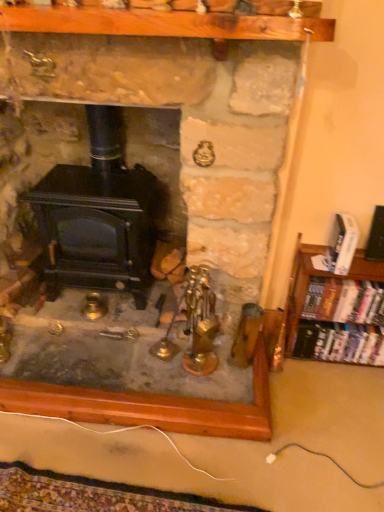
Find the location of a particular element. The image size is (384, 512). white glossy book at right, acting as the 1th book starting from the top is located at coordinates (342, 244).

Find the location of a particular element. The image size is (384, 512). black matte wood burning stove at center is located at coordinates pos(100,215).

I want to click on white glossy book at right, the third book from the bottom, so click(342, 244).

Is black matte wood burning stove at center inside hardcover books at right, which appears as the 2th book when ordered from the bottom?

No, hardcover books at right, which appears as the 2th book when ordered from the bottom, does not contain black matte wood burning stove at center.

Considering the relative positions of hardcover books at right, which appears as the 2th book when ordered from the bottom, and black matte wood burning stove at center in the image provided, is hardcover books at right, which appears as the 2th book when ordered from the bottom, in front of black matte wood burning stove at center?

No, hardcover books at right, which appears as the 2th book when ordered from the bottom, is further to the viewer.

Can you tell me how much hardcover books at right, the 2th book in the top-to-bottom sequence, and black matte wood burning stove at center differ in facing direction?

0.869 degrees.

Considering the sizes of objects hardcover books at right, the 1th book in the bottom-to-top sequence, and hardcover books at right, which appears as the 2th book when ordered from the bottom, in the image provided, who is wider, hardcover books at right, the 1th book in the bottom-to-top sequence, or hardcover books at right, which appears as the 2th book when ordered from the bottom,?

hardcover books at right, the 1th book in the bottom-to-top sequence.

From a real-world perspective, who is located higher, hardcover books at right, the 1th book in the bottom-to-top sequence, or hardcover books at right, which appears as the 2th book when ordered from the bottom?

In real-world perspective, hardcover books at right, which appears as the 2th book when ordered from the bottom, is above.

Is point (343, 349) positioned after point (379, 286)?

That is True.

Is hardcover books at right, the 2th book in the top-to-bottom sequence, located within hardcover books at right, which ranks as the third book in top-to-bottom order?

No.

At what (x,y) coordinates should I click in order to perform the action: click on wood burning stove on the left of hardcover books at right, which ranks as the third book in top-to-bottom order. Please return your answer as a coordinate pair (x, y). The height and width of the screenshot is (512, 384). Looking at the image, I should click on (x=100, y=215).

Is hardcover books at right, the 1th book in the bottom-to-top sequence, facing away from black matte wood burning stove at center?

No, black matte wood burning stove at center is not at the back of hardcover books at right, the 1th book in the bottom-to-top sequence.

How many degrees apart are the facing directions of hardcover books at right, which ranks as the third book in top-to-bottom order, and black matte wood burning stove at center?

1.49 degrees.

Which is less distant, [332,289] or [317,323]?

The point [332,289] is closer to the camera.

You are a GUI agent. You are given a task and a screenshot of the screen. Output one action in this format:
    pyautogui.click(x=<x>, y=<y>)
    Task: Click on the book that is under the hardcover books at right, the 2th book in the top-to-bottom sequence (from a real-world perspective)
    The height and width of the screenshot is (512, 384).
    Given the screenshot: What is the action you would take?
    pyautogui.click(x=339, y=343)

Can you confirm if hardcover books at right, which appears as the 2th book when ordered from the bottom, is shorter than hardcover books at right, the 1th book in the bottom-to-top sequence?

Yes, hardcover books at right, which appears as the 2th book when ordered from the bottom, is shorter than hardcover books at right, the 1th book in the bottom-to-top sequence.

From the image's perspective, which object appears higher, hardcover books at right, the 2th book in the top-to-bottom sequence, or hardcover books at right, the 1th book in the bottom-to-top sequence?

hardcover books at right, the 2th book in the top-to-bottom sequence, is shown above in the image.

How far apart are hardcover books at right, which ranks as the third book in top-to-bottom order, and white glossy book at right, acting as the 1th book starting from the top?

The distance of hardcover books at right, which ranks as the third book in top-to-bottom order, from white glossy book at right, acting as the 1th book starting from the top, is 39.01 centimeters.

From the picture: From a real-world perspective, which object rests below the other?

From a 3D spatial view, hardcover books at right, which ranks as the third book in top-to-bottom order, is below.

Can you confirm if hardcover books at right, which ranks as the third book in top-to-bottom order, is thinner than white glossy book at right, the third book from the bottom?

Indeed, hardcover books at right, which ranks as the third book in top-to-bottom order, has a lesser width compared to white glossy book at right, the third book from the bottom.

Is hardcover books at right, which ranks as the third book in top-to-bottom order, further to the viewer compared to white glossy book at right, the third book from the bottom?

Yes, it is behind white glossy book at right, the third book from the bottom.

Between white glossy book at right, the third book from the bottom, and black matte wood burning stove at center, which one has smaller width?

Thinner between the two is white glossy book at right, the third book from the bottom.

From the image's perspective, between white glossy book at right, the third book from the bottom, and black matte wood burning stove at center, which one is located above?

black matte wood burning stove at center appears higher in the image.

Considering the points (341, 244) and (84, 258), which point is in front, point (341, 244) or point (84, 258)?

The point (341, 244) is closer.

Which object is positioned more to the left, white glossy book at right, acting as the 1th book starting from the top, or black matte wood burning stove at center?

From the viewer's perspective, black matte wood burning stove at center appears more on the left side.

How many degrees apart are the facing directions of white glossy book at right, acting as the 1th book starting from the top, and hardcover books at right, the 1th book in the bottom-to-top sequence?

The angle between the facing direction of white glossy book at right, acting as the 1th book starting from the top, and the facing direction of hardcover books at right, the 1th book in the bottom-to-top sequence, is 3.79 degrees.

From the image's perspective, is white glossy book at right, acting as the 1th book starting from the top, under hardcover books at right, which ranks as the third book in top-to-bottom order?

Incorrect, from the image's perspective, white glossy book at right, acting as the 1th book starting from the top, is higher than hardcover books at right, which ranks as the third book in top-to-bottom order.

Based on the photo, are white glossy book at right, the third book from the bottom, and hardcover books at right, which ranks as the third book in top-to-bottom order, far apart?

No, there isn't a large distance between white glossy book at right, the third book from the bottom, and hardcover books at right, which ranks as the third book in top-to-bottom order.

Between white glossy book at right, acting as the 1th book starting from the top, and hardcover books at right, which ranks as the third book in top-to-bottom order, which one has more height?

hardcover books at right, which ranks as the third book in top-to-bottom order.

The width and height of the screenshot is (384, 512). What are the coordinates of `wood burning stove lying above the hardcover books at right, the 2th book in the top-to-bottom sequence (from the image's perspective)` in the screenshot? It's located at [100, 215].

The width and height of the screenshot is (384, 512). What are the coordinates of `the 1st book to the left of the hardcover books at right, which ranks as the third book in top-to-bottom order, starting your count from the anchor` in the screenshot? It's located at (344, 301).

When comparing their distances from hardcover books at right, the 1th book in the bottom-to-top sequence, does white glossy book at right, the third book from the bottom, or hardcover books at right, the 2th book in the top-to-bottom sequence, seem closer?

hardcover books at right, the 2th book in the top-to-bottom sequence, is closer to hardcover books at right, the 1th book in the bottom-to-top sequence.

Looking at the image, which one is located closer to black matte wood burning stove at center, hardcover books at right, which ranks as the third book in top-to-bottom order, or hardcover books at right, which appears as the 2th book when ordered from the bottom?

hardcover books at right, which appears as the 2th book when ordered from the bottom, is closer to black matte wood burning stove at center.

Based on their spatial positions, is white glossy book at right, acting as the 1th book starting from the top, or hardcover books at right, which appears as the 2th book when ordered from the bottom, closer to black matte wood burning stove at center?

hardcover books at right, which appears as the 2th book when ordered from the bottom.

Looking at the image, which one is located closer to hardcover books at right, which appears as the 2th book when ordered from the bottom, hardcover books at right, the 1th book in the bottom-to-top sequence, or black matte wood burning stove at center?

hardcover books at right, the 1th book in the bottom-to-top sequence, lies closer to hardcover books at right, which appears as the 2th book when ordered from the bottom, than the other object.

Considering their positions, is black matte wood burning stove at center positioned further to hardcover books at right, which appears as the 2th book when ordered from the bottom, than hardcover books at right, the 1th book in the bottom-to-top sequence?

Based on the image, black matte wood burning stove at center appears to be further to hardcover books at right, which appears as the 2th book when ordered from the bottom.

From the image, which object appears to be nearer to white glossy book at right, the third book from the bottom, hardcover books at right, which appears as the 2th book when ordered from the bottom, or black matte wood burning stove at center?

hardcover books at right, which appears as the 2th book when ordered from the bottom, lies closer to white glossy book at right, the third book from the bottom, than the other object.

Considering their positions, is hardcover books at right, which appears as the 2th book when ordered from the bottom, positioned closer to hardcover books at right, the 1th book in the bottom-to-top sequence, than black matte wood burning stove at center?

hardcover books at right, which appears as the 2th book when ordered from the bottom, is closer to hardcover books at right, the 1th book in the bottom-to-top sequence.

Looking at the image, which one is located further to black matte wood burning stove at center, hardcover books at right, the 1th book in the bottom-to-top sequence, or white glossy book at right, acting as the 1th book starting from the top?

hardcover books at right, the 1th book in the bottom-to-top sequence, is positioned further to the anchor black matte wood burning stove at center.

What are the coordinates of `book that lies between white glossy book at right, acting as the 1th book starting from the top, and hardcover books at right, the 1th book in the bottom-to-top sequence, from top to bottom` in the screenshot? It's located at (344, 301).

Where is `book between black matte wood burning stove at center and hardcover books at right, the 2th book in the top-to-bottom sequence, from left to right`? The height and width of the screenshot is (512, 384). book between black matte wood burning stove at center and hardcover books at right, the 2th book in the top-to-bottom sequence, from left to right is located at coordinates (342, 244).